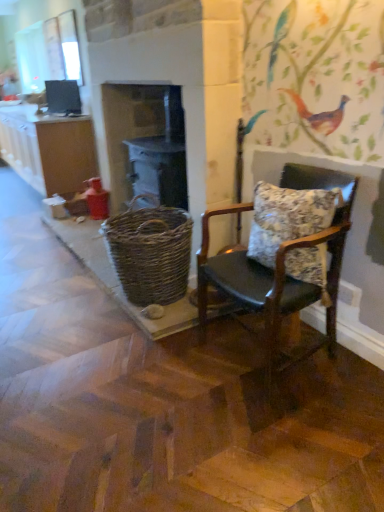
Question: From the image's perspective, is leather cushioned chair at right above or below woven brown basket at center?

Choices:
 (A) above
 (B) below

Answer: (B)

Question: Visually, is leather cushioned chair at right positioned to the left or to the right of woven brown basket at center?

Choices:
 (A) right
 (B) left

Answer: (A)

Question: Which object is positioned closest to the woven brown basket at center?

Choices:
 (A) woven wood basket at center
 (B) floral fabric pillow at right
 (C) matte black monitor at upper left
 (D) matte brown cabinet at left
 (E) clear glass window at upper left

Answer: (B)

Question: Estimate the real-world distances between objects in this image. Which object is closer to the matte black monitor at upper left?

Choices:
 (A) matte brown cabinet at left
 (B) floral fabric pillow at right
 (C) woven wood basket at center
 (D) leather cushioned chair at right
 (E) woven brown basket at center

Answer: (A)